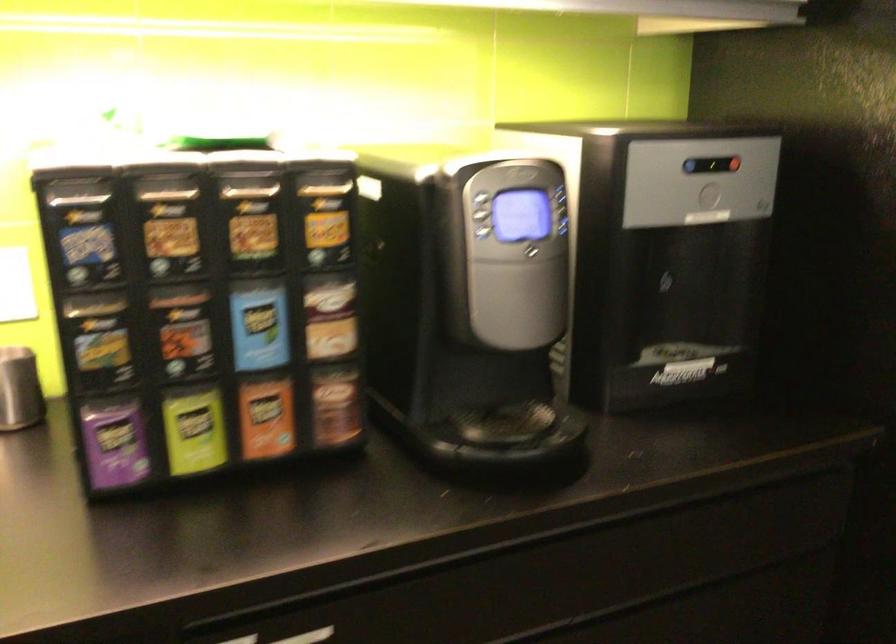
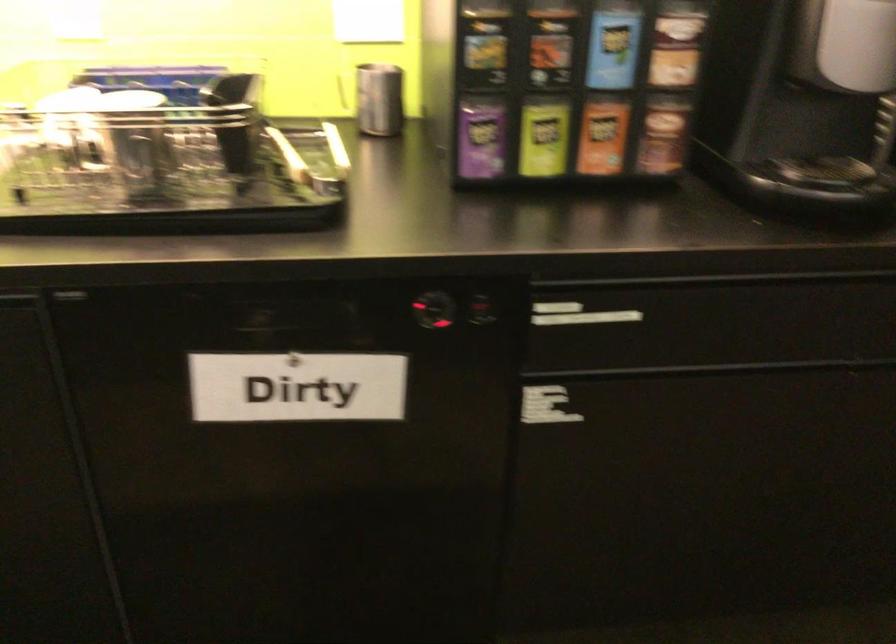
Locate, in the second image, the point that corresponds to point 194,431 in the first image.

(543, 138)